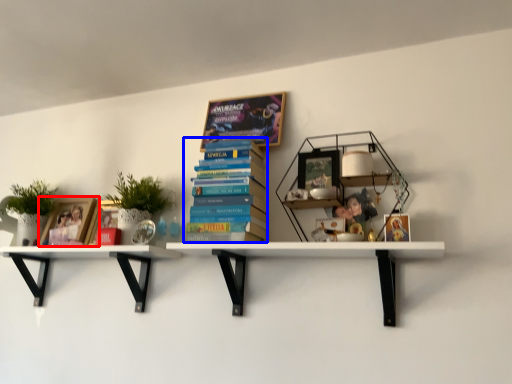
Question: Which of the following is the farthest to the observer, book cover (highlighted by a red box) or book (highlighted by a blue box)?

Choices:
 (A) book cover
 (B) book

Answer: (A)